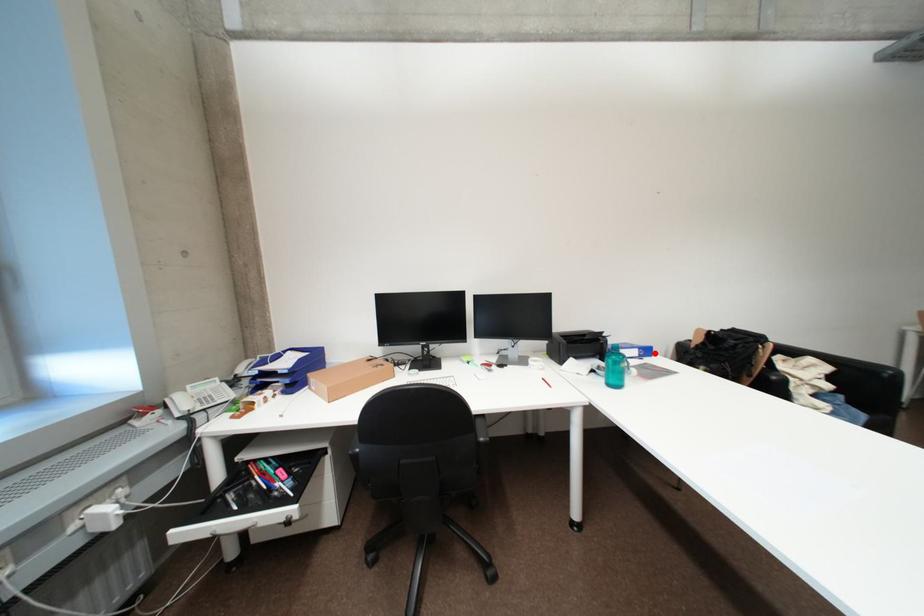
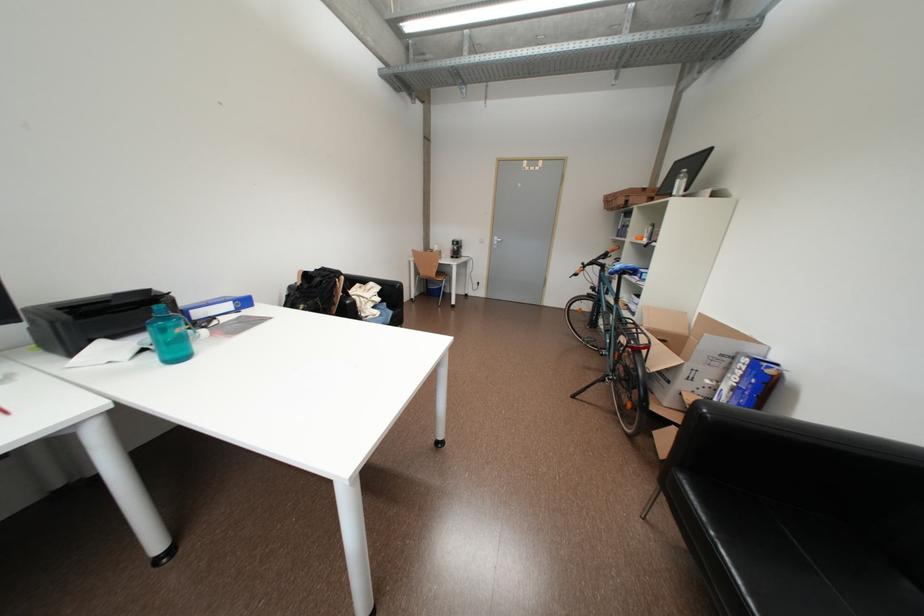
Question: I am providing you with two images of the same scene from different viewpoints. Image1 has a red point marked. In image2, the corresponding 3D location appears at what relative position? Reply with the corresponding letter.

Choices:
 (A) Closer
 (B) Farther

Answer: (A)